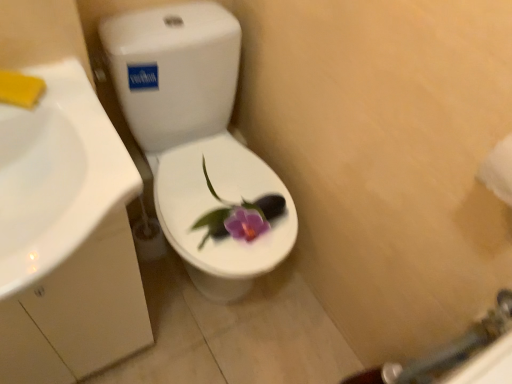
Question: Considering the relative positions of white glossy sink at left and white glossy toilet at center in the image provided, is white glossy sink at left to the left of white glossy toilet at center from the viewer's perspective?

Choices:
 (A) yes
 (B) no

Answer: (A)

Question: Would you say white glossy sink at left contains white glossy toilet at center?

Choices:
 (A) no
 (B) yes

Answer: (A)

Question: From the image's perspective, is white glossy sink at left on top of white glossy toilet at center?

Choices:
 (A) no
 (B) yes

Answer: (A)

Question: Is the surface of white glossy sink at left in direct contact with white glossy toilet at center?

Choices:
 (A) yes
 (B) no

Answer: (B)

Question: From the image's perspective, is white glossy sink at left located beneath white glossy toilet at center?

Choices:
 (A) yes
 (B) no

Answer: (A)

Question: Relative to white glossy toilet at center, is white paper towel at right in front or behind?

Choices:
 (A) front
 (B) behind

Answer: (A)

Question: Which is correct: white paper towel at right is inside white glossy toilet at center, or outside of it?

Choices:
 (A) outside
 (B) inside

Answer: (A)

Question: In terms of width, does white paper towel at right look wider or thinner when compared to white glossy toilet at center?

Choices:
 (A) wide
 (B) thin

Answer: (B)

Question: Considering the positions of point (495, 157) and point (189, 96), is point (495, 157) closer or farther from the camera than point (189, 96)?

Choices:
 (A) closer
 (B) farther

Answer: (A)

Question: Is white glossy toilet at center situated inside white paper towel at right or outside?

Choices:
 (A) outside
 (B) inside

Answer: (A)

Question: In the image, is white glossy toilet at center on the left side or the right side of white paper towel at right?

Choices:
 (A) right
 (B) left

Answer: (B)

Question: In terms of width, does white glossy toilet at center look wider or thinner when compared to white paper towel at right?

Choices:
 (A) thin
 (B) wide

Answer: (B)

Question: From a real-world perspective, is white glossy toilet at center above or below white paper towel at right?

Choices:
 (A) above
 (B) below

Answer: (B)

Question: Is white glossy toilet at center inside or outside of white glossy sink at left?

Choices:
 (A) outside
 (B) inside

Answer: (A)

Question: Would you say white glossy toilet at center is to the left or to the right of white glossy sink at left in the picture?

Choices:
 (A) right
 (B) left

Answer: (A)